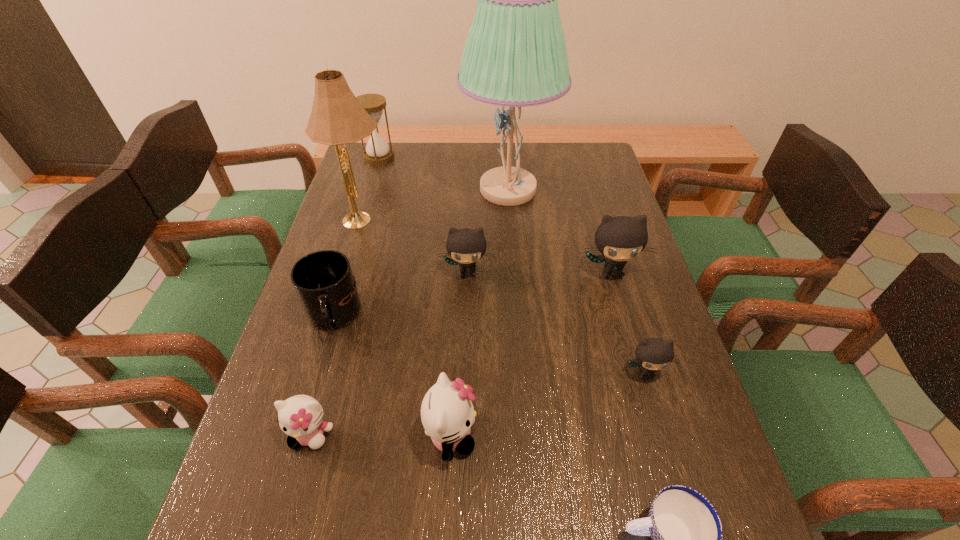
This screenshot has width=960, height=540. What are the coordinates of `the left white kitten` in the screenshot? It's located at (300, 417).

Locate an element on the screen. The height and width of the screenshot is (540, 960). the smaller white kitten is located at coordinates (300, 417).

Locate an element on the screen. This screenshot has width=960, height=540. the third nearest kitten is located at coordinates (652, 354).

Find the location of a particular element. The height and width of the screenshot is (540, 960). the nearest gray kitten is located at coordinates (652, 354).

Where is `blank area located 0.370m on the left of the teal lamp`? This screenshot has width=960, height=540. blank area located 0.370m on the left of the teal lamp is located at coordinates (348, 190).

Locate an element on the screen. free space located on the back of the ninth shortest object is located at coordinates (376, 173).

This screenshot has height=540, width=960. I want to click on blank space located on the right of the hourglass, so click(424, 157).

Locate an element on the screen. free space located 0.340m on the front-facing side of the biggest gray kitten is located at coordinates (650, 407).

At what (x,y) coordinates should I click in order to perform the action: click on free spot located on the front-facing side of the right white kitten. Please return your answer as a coordinate pair (x, y). The width and height of the screenshot is (960, 540). Looking at the image, I should click on (598, 435).

Where is `vacant space situated 0.120m on the front-facing side of the second smallest gray kitten`? This screenshot has width=960, height=540. vacant space situated 0.120m on the front-facing side of the second smallest gray kitten is located at coordinates (466, 320).